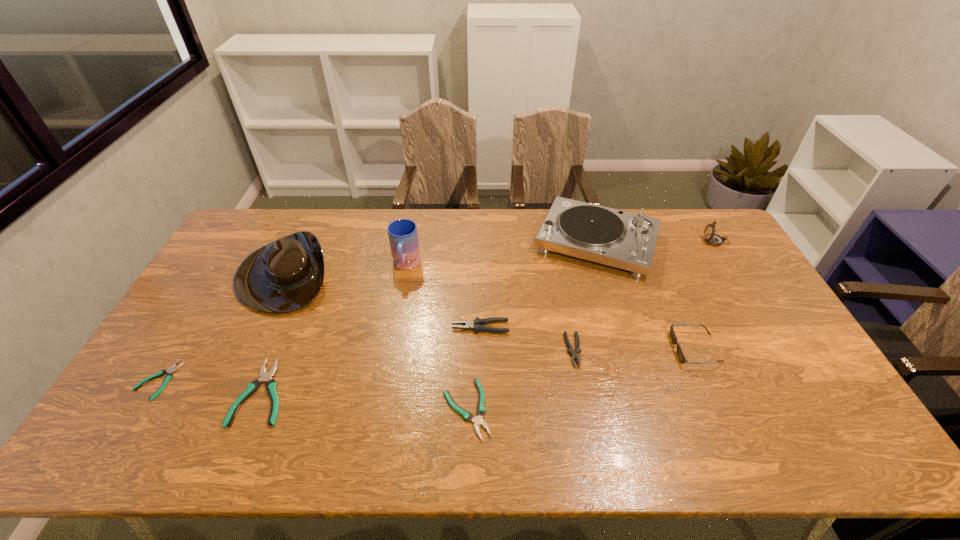
The width and height of the screenshot is (960, 540). What are the coordinates of `the rightmost pliers` in the screenshot? It's located at (570, 350).

Identify the location of the eighth tallest object. Image resolution: width=960 pixels, height=540 pixels. (271, 385).

Image resolution: width=960 pixels, height=540 pixels. I want to click on the third tallest pliers, so click(x=271, y=385).

The image size is (960, 540). I want to click on the rightmost teal pliers, so click(x=481, y=410).

Find the location of `the second shortest object`. the second shortest object is located at coordinates (481, 410).

Identify the location of the shortest object. (171, 369).

The image size is (960, 540). I want to click on the leftmost object, so click(x=171, y=369).

Image resolution: width=960 pixels, height=540 pixels. Find the location of `free spot located 0.160m on the side of the mug with the handle`. free spot located 0.160m on the side of the mug with the handle is located at coordinates tap(397, 318).

Find the location of a particular element. free space located 0.310m on the left of the record player is located at coordinates (446, 242).

Identify the location of vacant space situated 0.050m on the face of the compass. The width and height of the screenshot is (960, 540). (x=688, y=241).